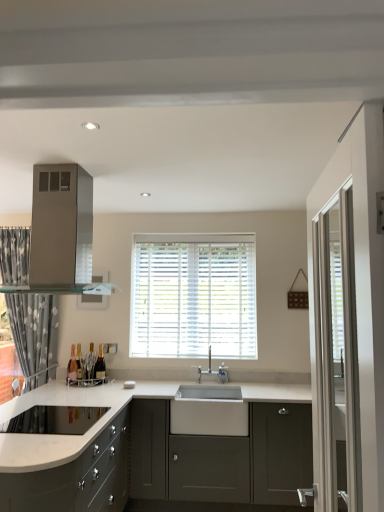
Question: Does white wood blinds at center appear on the left side of satin silver range hood at upper left?

Choices:
 (A) yes
 (B) no

Answer: (B)

Question: Is white wood blinds at center surrounding satin silver range hood at upper left?

Choices:
 (A) yes
 (B) no

Answer: (B)

Question: Is white wood blinds at center directly adjacent to satin silver range hood at upper left?

Choices:
 (A) no
 (B) yes

Answer: (A)

Question: Does white wood blinds at center have a smaller size compared to satin silver range hood at upper left?

Choices:
 (A) yes
 (B) no

Answer: (A)

Question: Does white wood blinds at center have a greater width compared to satin silver range hood at upper left?

Choices:
 (A) no
 (B) yes

Answer: (A)

Question: From a real-world perspective, is matte glass wine bottle at left, which appears as the 2th wine bottle when viewed from the right, above or below silver metallic faucet at center?

Choices:
 (A) above
 (B) below

Answer: (B)

Question: In terms of width, does matte glass wine bottle at left, the 1th wine bottle from the left, look wider or thinner when compared to silver metallic faucet at center?

Choices:
 (A) thin
 (B) wide

Answer: (A)

Question: Looking at the image, does matte glass wine bottle at left, the 1th wine bottle from the left, seem bigger or smaller compared to silver metallic faucet at center?

Choices:
 (A) big
 (B) small

Answer: (B)

Question: Do you think matte glass wine bottle at left, the 1th wine bottle from the left, is within silver metallic faucet at center, or outside of it?

Choices:
 (A) outside
 (B) inside

Answer: (A)

Question: Considering the positions of shiny dark glass wine bottle at lower left, arranged as the second wine bottle when viewed from the left, and silver metallic faucet at center in the image, is shiny dark glass wine bottle at lower left, arranged as the second wine bottle when viewed from the left, bigger or smaller than silver metallic faucet at center?

Choices:
 (A) big
 (B) small

Answer: (B)

Question: From a real-world perspective, is shiny dark glass wine bottle at lower left, marked as the first wine bottle in a right-to-left arrangement, physically located above or below silver metallic faucet at center?

Choices:
 (A) above
 (B) below

Answer: (B)

Question: Based on their positions, is shiny dark glass wine bottle at lower left, marked as the first wine bottle in a right-to-left arrangement, located to the left or right of silver metallic faucet at center?

Choices:
 (A) right
 (B) left

Answer: (B)

Question: From the image's perspective, is shiny dark glass wine bottle at lower left, arranged as the second wine bottle when viewed from the left, positioned above or below silver metallic faucet at center?

Choices:
 (A) below
 (B) above

Answer: (A)

Question: Is point (107, 493) closer or farther from the camera than point (33, 180)?

Choices:
 (A) farther
 (B) closer

Answer: (A)

Question: Considering the positions of matte gray cabinets at lower left, which is the 1th cabinetry in left-to-right order, and satin silver range hood at upper left in the image, is matte gray cabinets at lower left, which is the 1th cabinetry in left-to-right order, wider or thinner than satin silver range hood at upper left?

Choices:
 (A) thin
 (B) wide

Answer: (B)